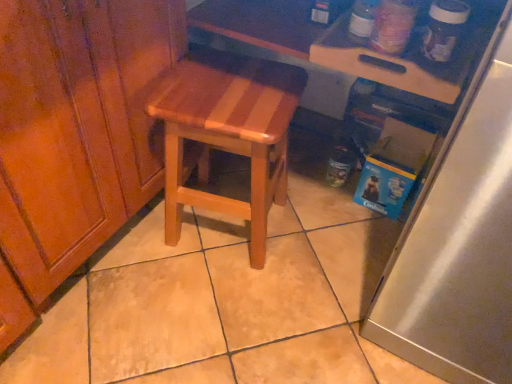
Where is `free space in front of wooden at center`? free space in front of wooden at center is located at coordinates (212, 306).